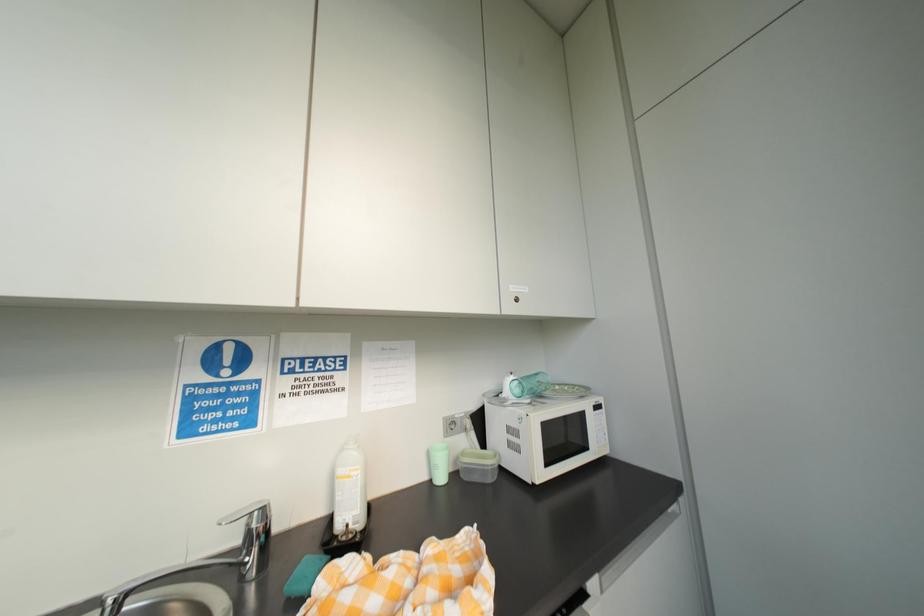
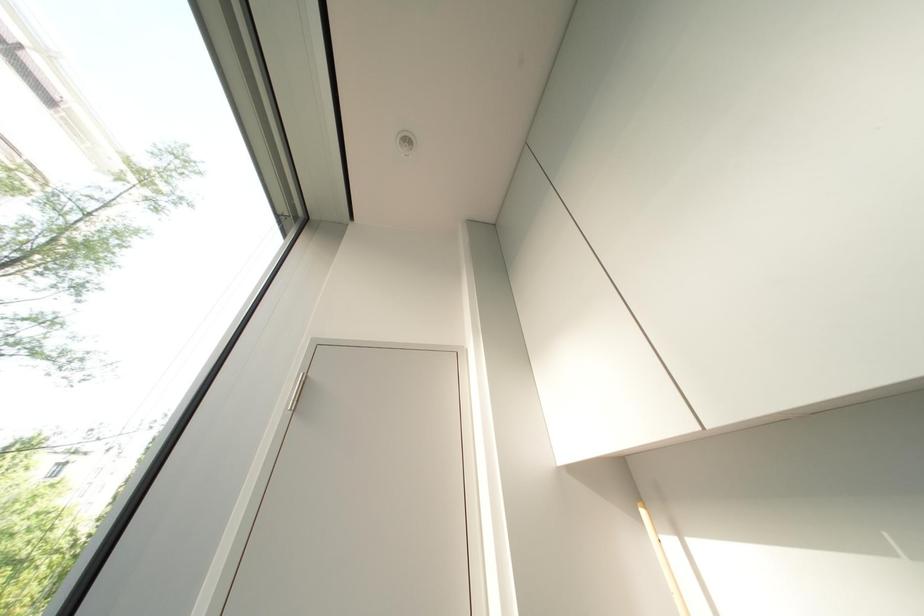
From the picture: The first image is from the beginning of the video and the second image is from the end. How did the camera likely rotate when shooting the video?

The rotation direction of the camera is left-up.